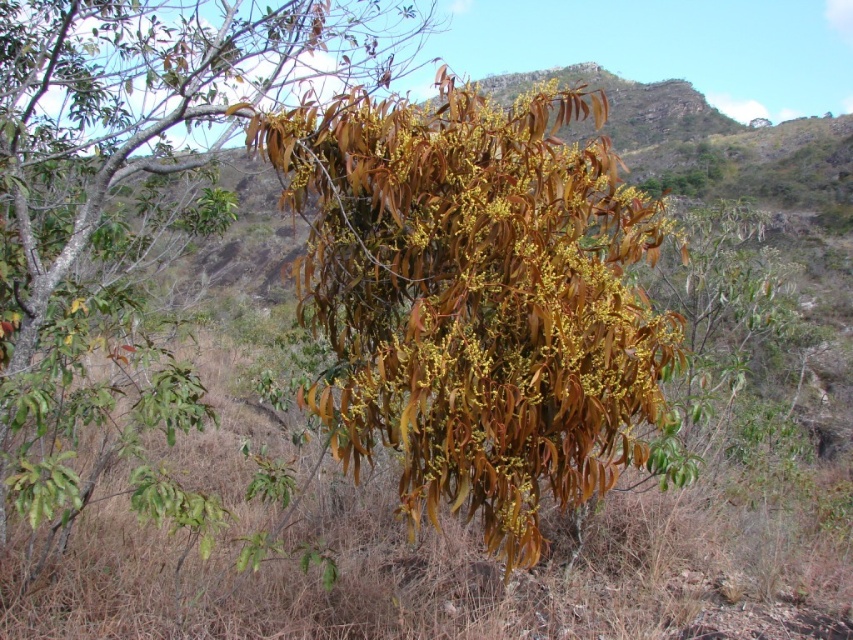
Does point (445, 332) come in front of point (254, 19)?

That is True.

At what (x,y) coordinates should I click in order to perform the action: click on brown leathery leaves at center. Please return your answer as a coordinate pair (x, y). Looking at the image, I should click on (474, 298).